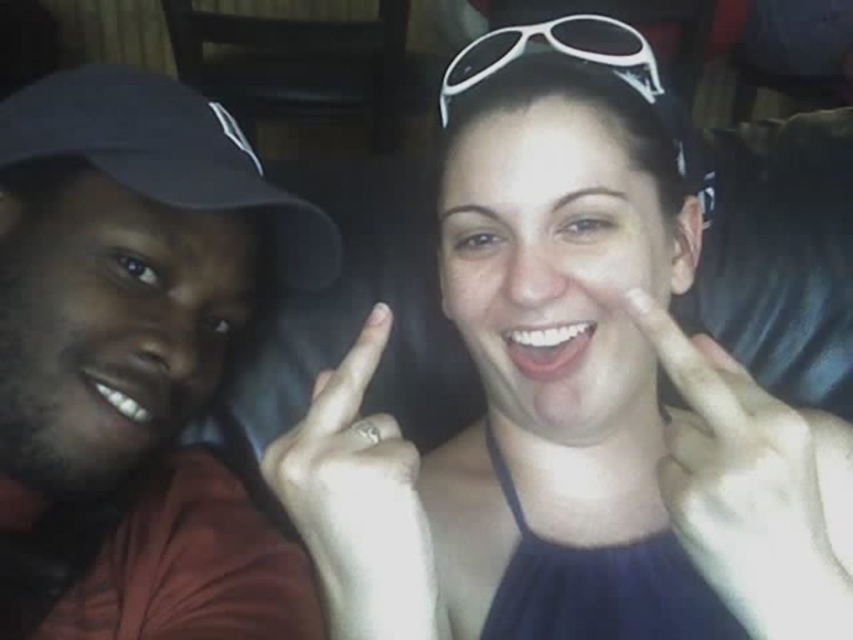
Does white matte hand at center have a larger size compared to white plastic sunglasses at upper center?

Correct, white matte hand at center is larger in size than white plastic sunglasses at upper center.

Is point (827, 436) positioned after point (473, 84)?

Yes.

What are the coordinates of `white matte hand at center` in the screenshot? It's located at (753, 488).

Does matte black cap at left appear under white matte hand at center?

No.

Is matte black cap at left wider than white matte hand at center?

Yes.

What do you see at coordinates (134, 362) in the screenshot?
I see `matte black cap at left` at bounding box center [134, 362].

Locate an element on the screen. The width and height of the screenshot is (853, 640). matte black cap at left is located at coordinates point(134,362).

Based on the photo, which of these two, white matte sunglasses at upper center or matte black cap at left, stands shorter?

Standing shorter between the two is white matte sunglasses at upper center.

Between white matte sunglasses at upper center and matte black cap at left, which one is positioned lower?

white matte sunglasses at upper center is lower down.

The width and height of the screenshot is (853, 640). I want to click on white matte sunglasses at upper center, so click(x=567, y=376).